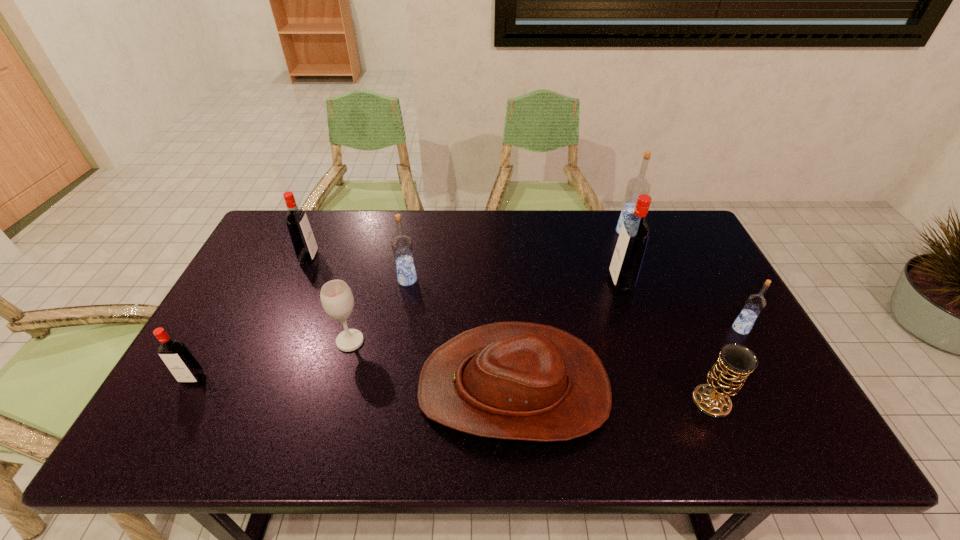
Where is `cowboy hat that is positioned at the near edge`? The width and height of the screenshot is (960, 540). cowboy hat that is positioned at the near edge is located at coordinates (514, 380).

At what (x,y) coordinates should I click in order to perform the action: click on vodka at the right edge. Please return your answer as a coordinate pair (x, y). This screenshot has width=960, height=540. Looking at the image, I should click on (755, 303).

Where is `chalice located in the right edge section of the desktop`? This screenshot has height=540, width=960. chalice located in the right edge section of the desktop is located at coordinates (726, 377).

This screenshot has height=540, width=960. I want to click on object at the far left corner, so click(x=303, y=241).

Where is `object present at the near right corner`? This screenshot has width=960, height=540. object present at the near right corner is located at coordinates (726, 377).

Where is `vacant space at the far edge of the desktop`? The image size is (960, 540). vacant space at the far edge of the desktop is located at coordinates (325, 215).

This screenshot has height=540, width=960. Identify the location of blank space at the left edge. (225, 335).

Locate an element on the screen. Image resolution: width=960 pixels, height=540 pixels. free space at the right edge of the desktop is located at coordinates (722, 322).

In the image, there is a desktop. Where is `vacant region at the far right corner`? Image resolution: width=960 pixels, height=540 pixels. vacant region at the far right corner is located at coordinates (673, 235).

At what (x,y) coordinates should I click in order to perform the action: click on free spot between the chalice and the biggest red vodka. Please return your answer as a coordinate pair (x, y). This screenshot has width=960, height=540. Looking at the image, I should click on 666,342.